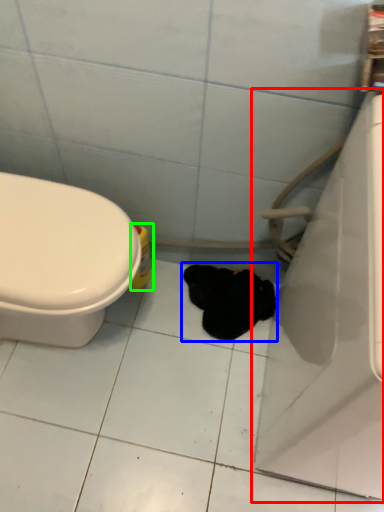
Question: Which is nearer to the bath (highlighted by a red box)? animal (highlighted by a blue box) or cleaning product (highlighted by a green box).

Choices:
 (A) animal
 (B) cleaning product

Answer: (A)